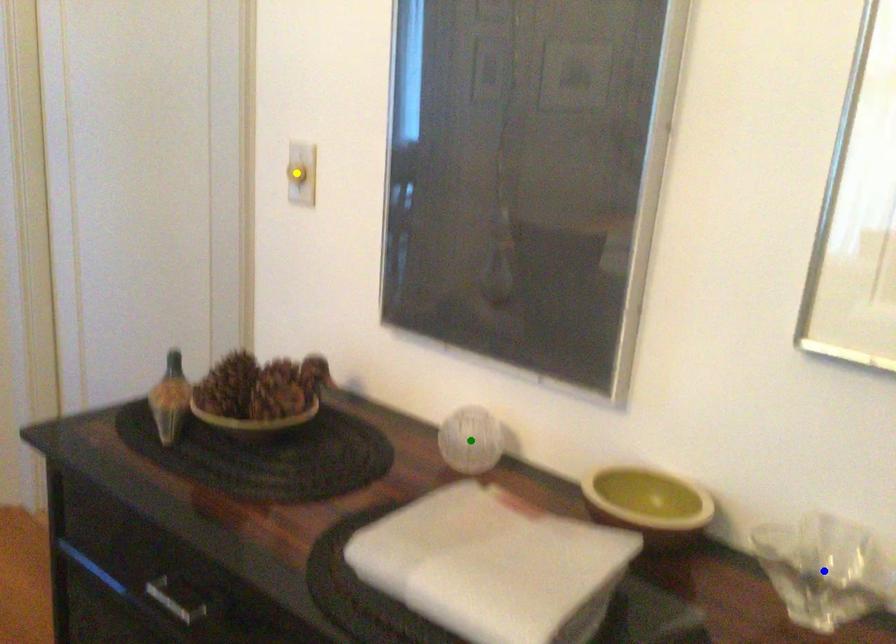
Order these from nearest to farthest:
yellow point, blue point, green point

yellow point
green point
blue point